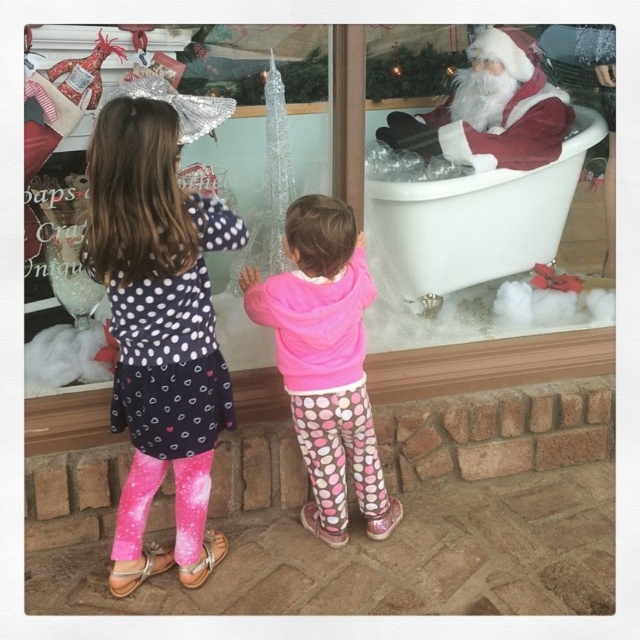
You are a parent trying to decide which gift to buy for your child. The shop window has a white porcelain bathtub at right and a velvet santa claus at right. Which item is taller?

The white porcelain bathtub at right is taller than the velvet santa claus at right.

You are taking a photo of the two points in the shop window scene. Which point, point (x=356, y=282) or point (x=550, y=218), will appear larger in your photo?

Point (x=356, y=282) will appear larger in the photo because it is closer to the camera than point (x=550, y=218).

You are a delivery person who needs to place a new toy into the shop window. The toy requires a space larger than the velvet santa claus at right. Can the white porcelain bathtub at right accommodate the toy?

The white porcelain bathtub at right is bigger than the velvet santa claus at right, so yes, the white porcelain bathtub at right can accommodate the toy.